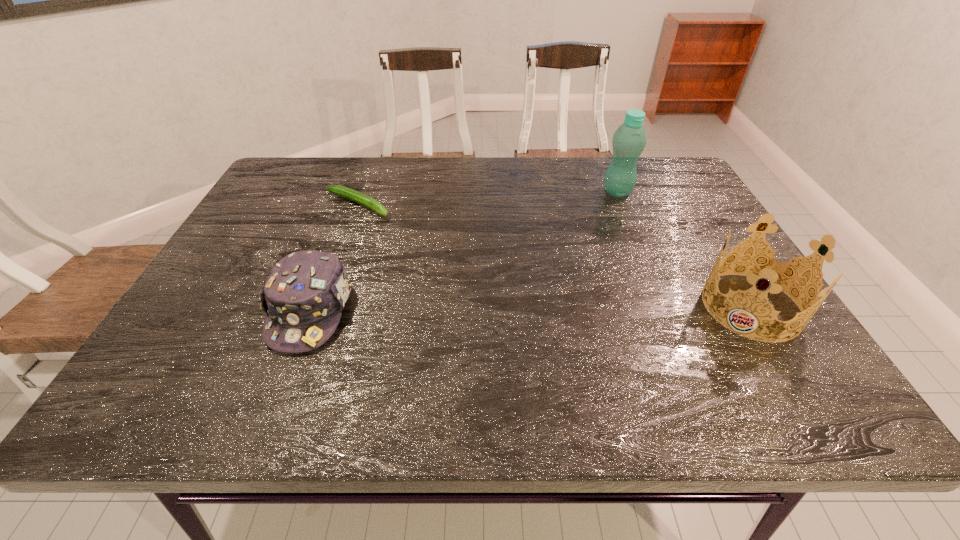
The image size is (960, 540). I want to click on blank area located on the front-facing side of the zucchini, so click(402, 222).

The image size is (960, 540). I want to click on vacant space situated 0.160m on the front-facing side of the zucchini, so click(x=427, y=234).

The image size is (960, 540). Identify the location of free space located 0.060m on the front-facing side of the zucchini. (399, 221).

The image size is (960, 540). What are the coordinates of `water bottle that is at the far edge` in the screenshot? It's located at (629, 140).

You are a GUI agent. You are given a task and a screenshot of the screen. Output one action in this format:
    pyautogui.click(x=<x>, y=<y>)
    Task: Click on the zucchini present at the far edge
    
    Given the screenshot: What is the action you would take?
    pyautogui.click(x=350, y=194)

You are a GUI agent. You are given a task and a screenshot of the screen. Output one action in this format:
    pyautogui.click(x=<x>, y=<y>)
    Task: Click on the headwear that is at the near edge
    The width and height of the screenshot is (960, 540).
    Given the screenshot: What is the action you would take?
    pyautogui.click(x=304, y=295)

Identify the location of crown that is at the near edge. (773, 272).

In order to click on object located in the right edge section of the desktop in this screenshot , I will do `click(773, 272)`.

This screenshot has height=540, width=960. I want to click on object positioned at the near right corner, so click(773, 272).

Find the location of a particular element. The image size is (960, 540). free spot at the far edge of the desktop is located at coordinates (469, 181).